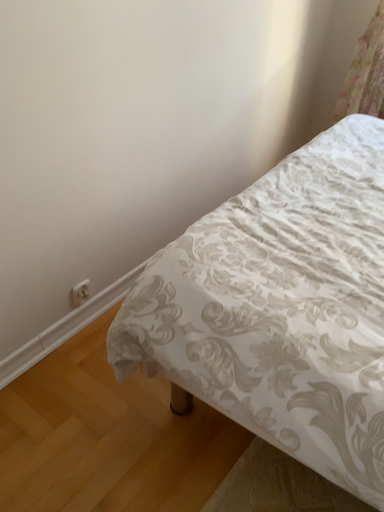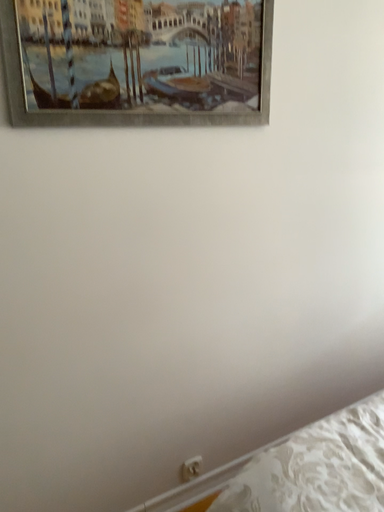
Question: Which way did the camera rotate in the video?

Choices:
 (A) rotated left
 (B) rotated right

Answer: (A)